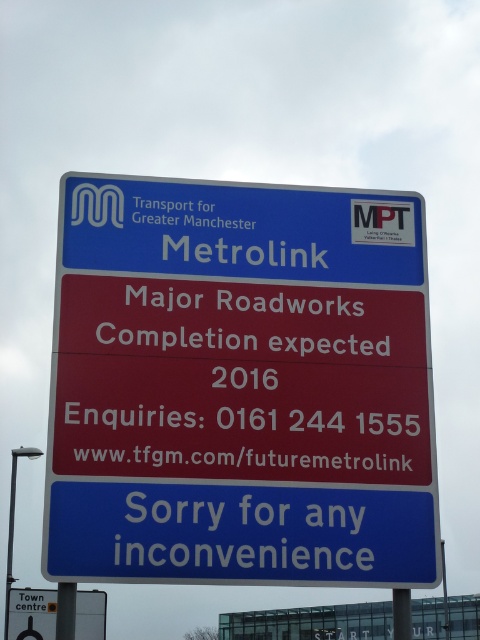
Question: Can you confirm if blue plastic signboard at upper center is thinner than yellow plastic sign at lower left?

Choices:
 (A) yes
 (B) no

Answer: (A)

Question: Can you confirm if blue plastic signboard at upper center is positioned to the right of yellow plastic sign at lower left?

Choices:
 (A) yes
 (B) no

Answer: (A)

Question: Which of the following is the closest to the observer?

Choices:
 (A) (34, 625)
 (B) (290, 236)

Answer: (B)

Question: Which of the following is the farthest from the observer?

Choices:
 (A) (406, 385)
 (B) (82, 618)

Answer: (B)

Question: From the image, what is the correct spatial relationship of blue plastic signboard at upper center in relation to yellow plastic sign at lower left?

Choices:
 (A) right
 (B) left

Answer: (A)